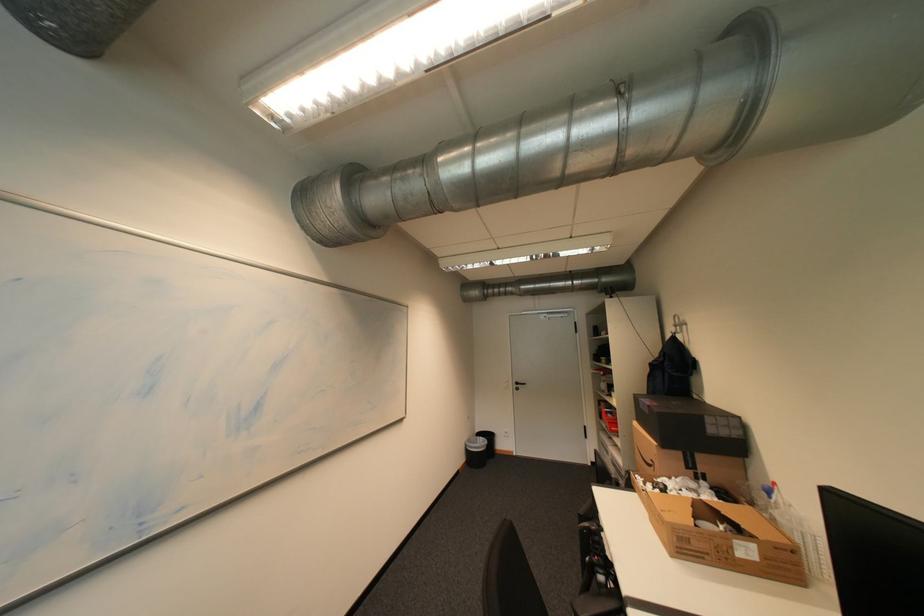
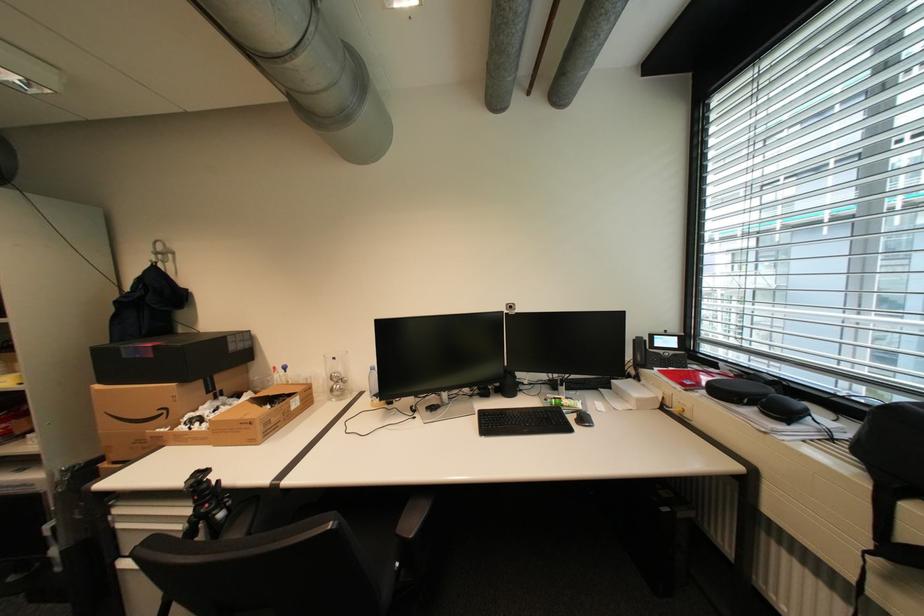
The point at (685, 326) is marked in the first image. Where is the corresponding point in the second image?

(165, 254)